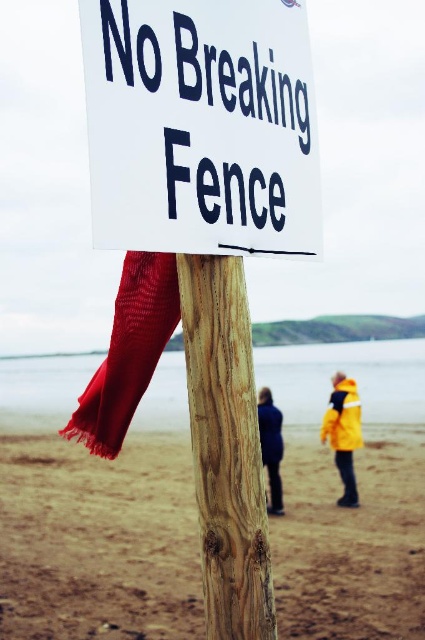
Does white plastic sign at center appear under dark blue jacket at center?

Actually, white plastic sign at center is above dark blue jacket at center.

Who is lower down, white plastic sign at center or dark blue jacket at center?

dark blue jacket at center is lower down.

This screenshot has height=640, width=425. In order to click on white plastic sign at center in this screenshot , I will do `click(201, 125)`.

Locate an element on the screen. The height and width of the screenshot is (640, 425). white plastic sign at center is located at coordinates (201, 125).

Does wooden post at center appear on the right side of yellow matte jacket at lower right?

In fact, wooden post at center is to the left of yellow matte jacket at lower right.

What do you see at coordinates (226, 449) in the screenshot? The image size is (425, 640). I see `wooden post at center` at bounding box center [226, 449].

The height and width of the screenshot is (640, 425). What do you see at coordinates (226, 449) in the screenshot? I see `wooden post at center` at bounding box center [226, 449].

You are a GUI agent. You are given a task and a screenshot of the screen. Output one action in this format:
    pyautogui.click(x=<x>, y=<y>)
    Task: Click on the wooden post at center
    The width and height of the screenshot is (425, 640).
    Given the screenshot: What is the action you would take?
    pyautogui.click(x=226, y=449)

Is white plastic sign at center taller than yellow matte jacket at lower right?

Incorrect, white plastic sign at center's height is not larger of yellow matte jacket at lower right's.

Can you confirm if white plastic sign at center is shorter than yellow matte jacket at lower right?

Indeed, white plastic sign at center has a lesser height compared to yellow matte jacket at lower right.

Where is `white plastic sign at center`? This screenshot has height=640, width=425. white plastic sign at center is located at coordinates (201, 125).

Locate an element on the screen. The height and width of the screenshot is (640, 425). white plastic sign at center is located at coordinates (201, 125).